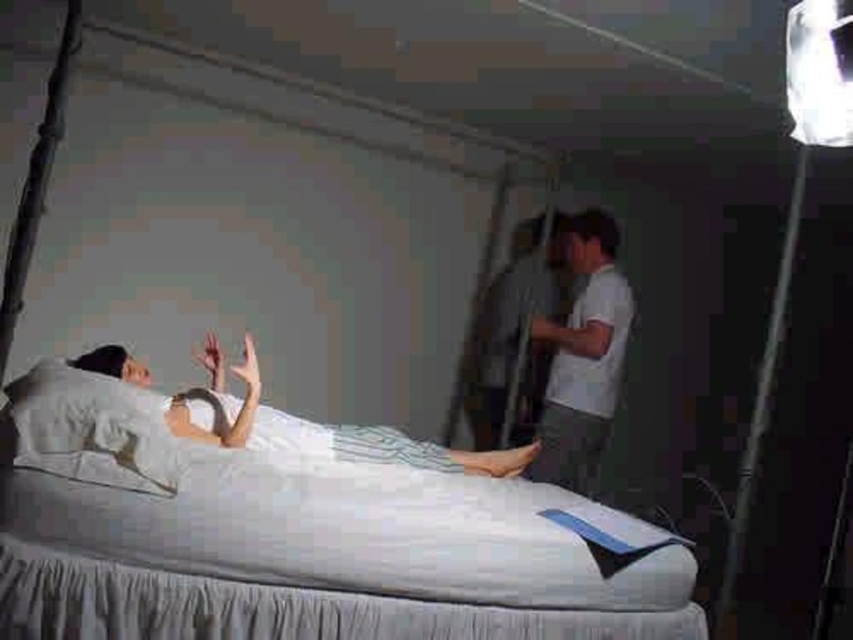
Can you confirm if white cotton shirt at right is taller than white satin dress at center?

Correct, white cotton shirt at right is much taller as white satin dress at center.

Can you confirm if white cotton shirt at right is thinner than white satin dress at center?

Yes, white cotton shirt at right is thinner than white satin dress at center.

The height and width of the screenshot is (640, 853). Describe the element at coordinates (583, 356) in the screenshot. I see `white cotton shirt at right` at that location.

Where is `white cotton shirt at right`? white cotton shirt at right is located at coordinates [x=583, y=356].

Does white fabric bed at center appear under white satin dress at center?

Correct, white fabric bed at center is located below white satin dress at center.

Between white fabric bed at center and white satin dress at center, which one appears on the right side from the viewer's perspective?

white fabric bed at center

Where is `white fabric bed at center`? This screenshot has height=640, width=853. white fabric bed at center is located at coordinates (299, 540).

Is point (260, 547) farther from viewer compared to point (131, 404)?

No, (260, 547) is in front of (131, 404).

Who is more forward, (93, 412) or (175, 481)?

Point (175, 481)

Who is more distant from viewer, [86,579] or [149,458]?

The point [149,458] is more distant.

The image size is (853, 640). Identify the location of white fabric bed at center. (299, 540).